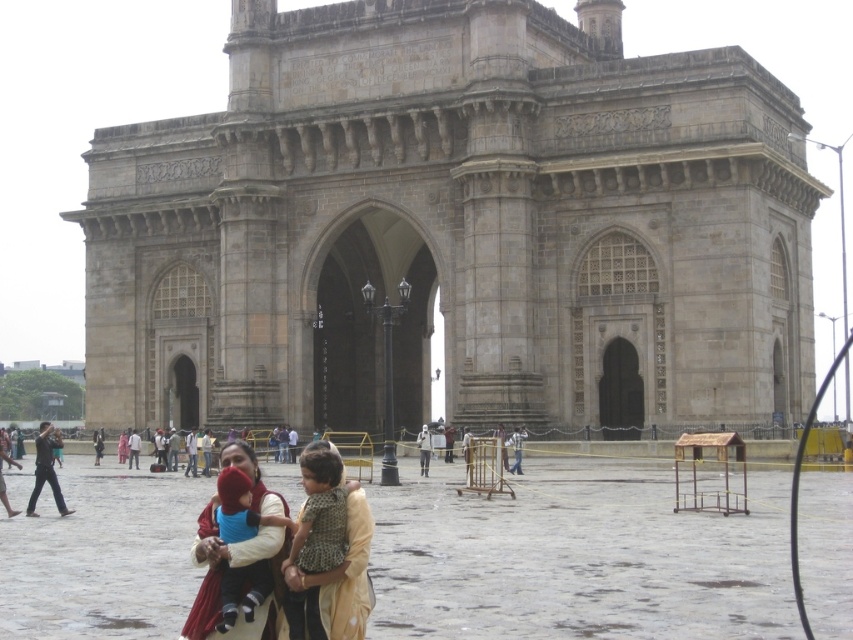
You are a photographer planning to take a group photo of the matte blue fabric at center and the dark brown leather jacket at lower left. Which object should you place closer to the camera to ensure both appear the same size in the photo?

To make both the matte blue fabric at center and the dark brown leather jacket at lower left appear the same size in the photo, you should place the matte blue fabric at center closer to the camera since it has a smaller size compared to the dark brown leather jacket at lower left.

You are a photographer standing in front of the Gateway of India monument. You notice two women wearing dresses in the scene. One is wearing a beige fabric dress at center and the other a brown textured dress at center. Which dress should you focus on to capture the one that is nearer to you?

The beige fabric dress at center is closer to the viewer than the brown textured dress at center, so you should focus on the beige fabric dress at center to capture the one that is nearer to you.